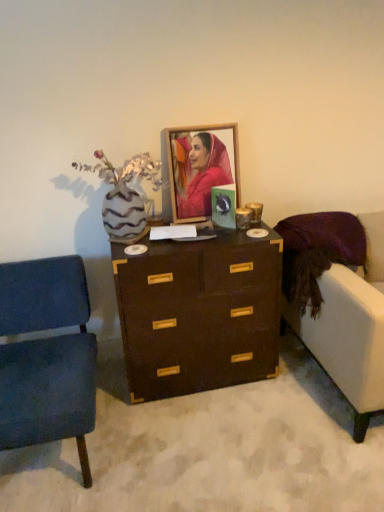
The height and width of the screenshot is (512, 384). Describe the element at coordinates (200, 168) in the screenshot. I see `matte wooden picture frame at center` at that location.

Where is `brown wood chest of drawers at center`? Image resolution: width=384 pixels, height=512 pixels. brown wood chest of drawers at center is located at coordinates (199, 313).

Image resolution: width=384 pixels, height=512 pixels. Identify the location of velvet white couch at right. click(339, 301).

Is there a large distance between velvet white couch at right and brown wood chest of drawers at center?

No, velvet white couch at right is in close proximity to brown wood chest of drawers at center.

Which object is more forward, velvet white couch at right or brown wood chest of drawers at center?

velvet white couch at right is in front.

Can you confirm if velvet white couch at right is shorter than brown wood chest of drawers at center?

Incorrect, the height of velvet white couch at right does not fall short of that of brown wood chest of drawers at center.

From the image's perspective, is velvet white couch at right over brown wood chest of drawers at center?

Yes, from the image's perspective, velvet white couch at right is above brown wood chest of drawers at center.

Between brown wood chest of drawers at center and zebra-patterned vase with dried flowers at left, which one has more height?

brown wood chest of drawers at center is taller.

From a real-world perspective, which is physically above, brown wood chest of drawers at center or zebra-patterned vase with dried flowers at left?

zebra-patterned vase with dried flowers at left, from a real-world perspective.

Where is `floral arrangement on the left of brown wood chest of drawers at center`? The width and height of the screenshot is (384, 512). floral arrangement on the left of brown wood chest of drawers at center is located at coordinates (125, 195).

Which is closer to the camera, (x=256, y=289) or (x=357, y=270)?

Point (x=256, y=289) appears to be closer to the viewer than point (x=357, y=270).

From a real-world perspective, is brown wood chest of drawers at center above or below velvet white couch at right?

brown wood chest of drawers at center is situated lower than velvet white couch at right in the real world.

Consider the image. Between brown wood chest of drawers at center and velvet white couch at right, which one has more height?

velvet white couch at right is taller.

Which is behind, velvet white couch at right or velvet blue chair at left?

velvet white couch at right is further away from the camera.

Does point (342, 342) come behind point (53, 429)?

That is True.

From the image's perspective, which object appears higher, velvet white couch at right or velvet blue chair at left?

velvet white couch at right appears higher in the image.

From a real-world perspective, is matte wooden picture frame at center below velvet blue chair at left?

No, from a real-world perspective, matte wooden picture frame at center is not below velvet blue chair at left.

Does matte wooden picture frame at center have a greater width compared to velvet blue chair at left?

Incorrect, the width of matte wooden picture frame at center does not surpass that of velvet blue chair at left.

Does matte wooden picture frame at center appear on the right side of velvet blue chair at left?

Indeed, matte wooden picture frame at center is positioned on the right side of velvet blue chair at left.

Which is correct: matte wooden picture frame at center is inside velvet blue chair at left, or outside of it?

The correct answer is: outside.

The image size is (384, 512). I want to click on chair located in front of the velvet white couch at right, so click(46, 356).

From the image's perspective, between velvet blue chair at left and velvet white couch at right, who is located below?

velvet blue chair at left appears lower in the image.

Is velvet blue chair at left beside velvet white couch at right?

Answer: No, velvet blue chair at left is not beside velvet white couch at right.

Would you say velvet blue chair at left is outside velvet white couch at right?

That's correct, velvet blue chair at left is outside of velvet white couch at right.

Considering the sizes of objects zebra-patterned vase with dried flowers at left and velvet blue chair at left in the image provided, who is thinner, zebra-patterned vase with dried flowers at left or velvet blue chair at left?

zebra-patterned vase with dried flowers at left.

From the image's perspective, is zebra-patterned vase with dried flowers at left located above velvet blue chair at left?

Yes, from the image's perspective, zebra-patterned vase with dried flowers at left is over velvet blue chair at left.

In the image, is zebra-patterned vase with dried flowers at left positioned in front of or behind velvet blue chair at left?

zebra-patterned vase with dried flowers at left is behind velvet blue chair at left.

Where is `studio couch in front of the brown wood chest of drawers at center`? This screenshot has width=384, height=512. studio couch in front of the brown wood chest of drawers at center is located at coordinates (339, 301).

Locate an element on the screen. chest of drawers below the zebra-patterned vase with dried flowers at left (from a real-world perspective) is located at coordinates (199, 313).

Which object lies further to the anchor point velvet white couch at right, matte wooden picture frame at center or brown wood chest of drawers at center?

Among the two, matte wooden picture frame at center is located further to velvet white couch at right.

Estimate the real-world distances between objects in this image. Which object is closer to matte wooden picture frame at center, zebra-patterned vase with dried flowers at left or velvet white couch at right?

zebra-patterned vase with dried flowers at left.

When comparing their distances from matte wooden picture frame at center, does zebra-patterned vase with dried flowers at left or brown wood chest of drawers at center seem closer?

zebra-patterned vase with dried flowers at left lies closer to matte wooden picture frame at center than the other object.

From the image, which object appears to be nearer to velvet white couch at right, velvet blue chair at left or zebra-patterned vase with dried flowers at left?

The object closer to velvet white couch at right is zebra-patterned vase with dried flowers at left.

When comparing their distances from velvet white couch at right, does brown wood chest of drawers at center or matte wooden picture frame at center seem closer?

brown wood chest of drawers at center is closer to velvet white couch at right.

Considering their positions, is zebra-patterned vase with dried flowers at left positioned further to velvet white couch at right than matte wooden picture frame at center?

zebra-patterned vase with dried flowers at left lies further to velvet white couch at right than the other object.

Estimate the real-world distances between objects in this image. Which object is closer to velvet white couch at right, matte wooden picture frame at center or zebra-patterned vase with dried flowers at left?

matte wooden picture frame at center is closer to velvet white couch at right.

Considering their positions, is velvet white couch at right positioned further to matte wooden picture frame at center than zebra-patterned vase with dried flowers at left?

The object further to matte wooden picture frame at center is velvet white couch at right.

Find the location of `chest of drawers between matte wooden picture frame at center and velvet blue chair at left in the vertical direction`. chest of drawers between matte wooden picture frame at center and velvet blue chair at left in the vertical direction is located at coordinates (199, 313).

The image size is (384, 512). Identify the location of chest of drawers between zebra-patterned vase with dried flowers at left and velvet blue chair at left from top to bottom. (199, 313).

Locate an element on the screen. This screenshot has height=512, width=384. picture frame between velvet blue chair at left and velvet white couch at right in the horizontal direction is located at coordinates (200, 168).

Identify the location of floral arrangement between velvet blue chair at left and velvet white couch at right in the horizontal direction. The image size is (384, 512). (125, 195).